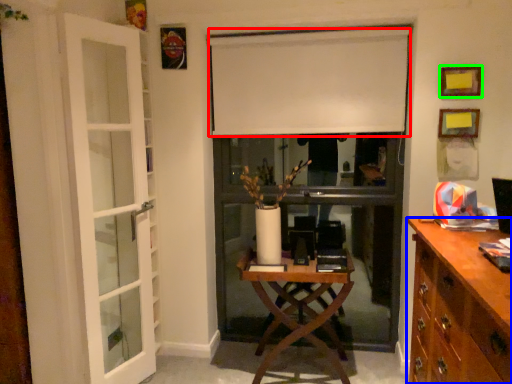
Question: Based on their relative distances, which object is farther from curtain (highlighted by a red box)? Choose from cabinetry (highlighted by a blue box) and picture frame (highlighted by a green box).

Choices:
 (A) cabinetry
 (B) picture frame

Answer: (A)